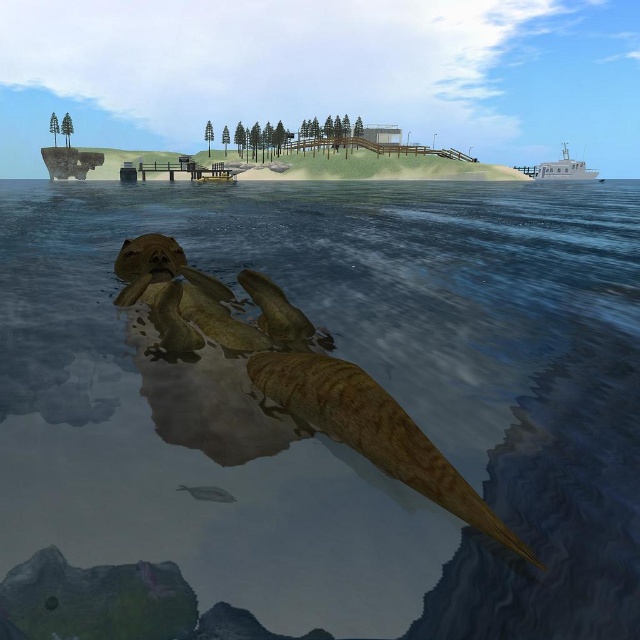
Question: Is brown textured water at center positioned in front of white matte boat at upper right?

Choices:
 (A) yes
 (B) no

Answer: (A)

Question: Is brown textured water at center thinner than white matte boat at upper right?

Choices:
 (A) no
 (B) yes

Answer: (A)

Question: Does brown textured water at center have a greater width compared to white matte boat at upper right?

Choices:
 (A) no
 (B) yes

Answer: (B)

Question: Which point is closer to the camera taking this photo?

Choices:
 (A) (547, 172)
 (B) (241, 228)

Answer: (B)